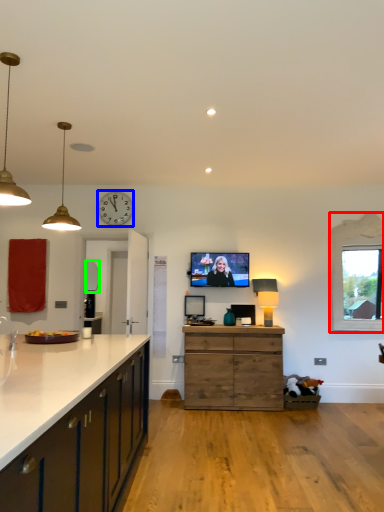
Question: Which is farther away from window (highlighted by a red box)? clock (highlighted by a blue box) or mirror (highlighted by a green box)?

Choices:
 (A) clock
 (B) mirror

Answer: (B)